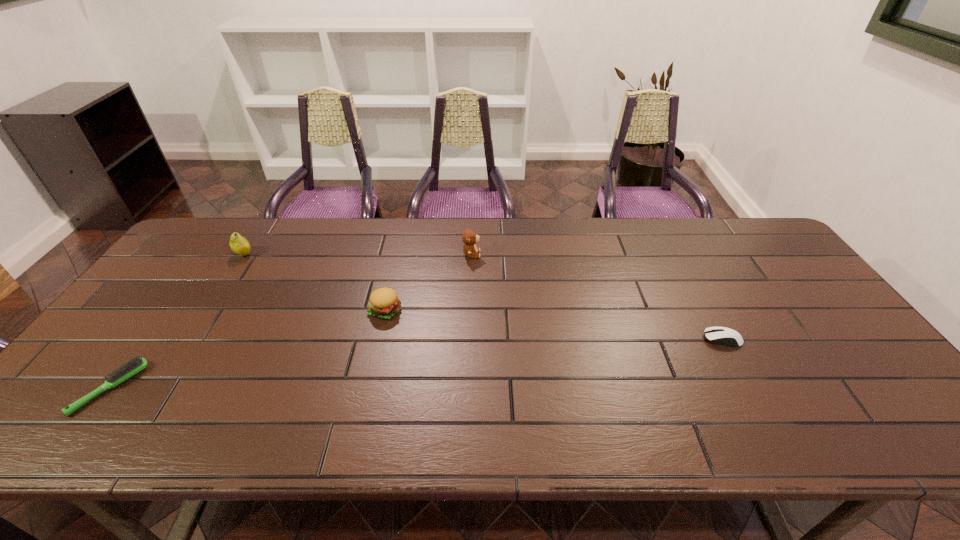
The height and width of the screenshot is (540, 960). What are the coordinates of `free space located 0.100m on the left of the third tallest object` in the screenshot? It's located at (332, 310).

At what (x,y) coordinates should I click in order to perform the action: click on free space located 0.170m on the back of the rightmost object. Please return your answer as a coordinate pair (x, y). This screenshot has height=540, width=960. Looking at the image, I should click on (694, 287).

What are the coordinates of `vacant space located on the back of the leftmost object` in the screenshot? It's located at (163, 318).

The width and height of the screenshot is (960, 540). Find the location of `pear at the far edge`. pear at the far edge is located at coordinates (238, 244).

The width and height of the screenshot is (960, 540). I want to click on teddy bear that is positioned at the far edge, so click(x=470, y=238).

Identify the location of object that is positioned at the near edge. The width and height of the screenshot is (960, 540). (136, 365).

The width and height of the screenshot is (960, 540). Find the location of `object present at the left edge`. object present at the left edge is located at coordinates (136, 365).

Find the location of a particular element. object that is at the near left corner is located at coordinates (136, 365).

You are a GUI agent. You are given a task and a screenshot of the screen. Output one action in this format:
    pyautogui.click(x=<x>, y=<y>)
    Task: Click on the vacant space at the far edge of the desktop
    This screenshot has width=960, height=540.
    Given the screenshot: What is the action you would take?
    pyautogui.click(x=580, y=251)

Where is `vacant space at the near edge`? vacant space at the near edge is located at coordinates (388, 429).